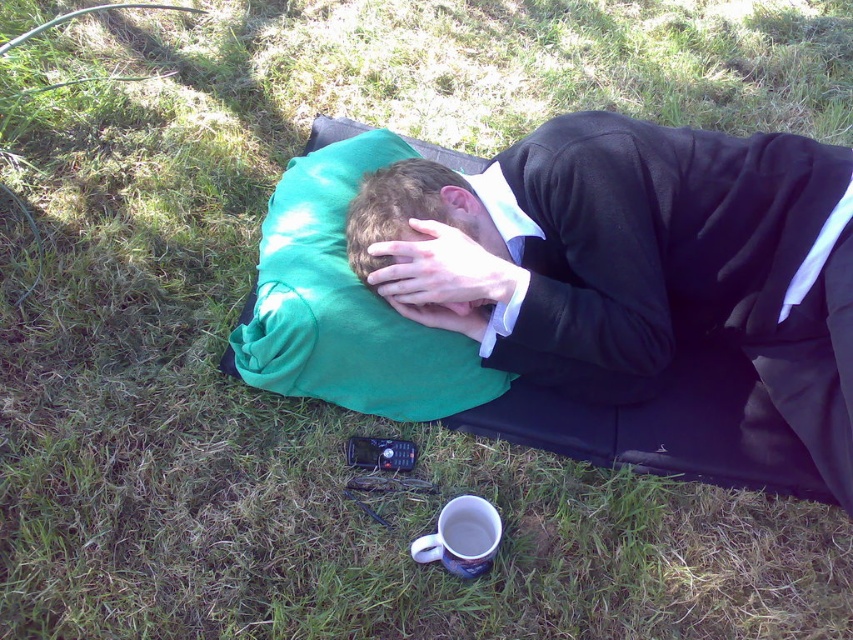
Consider the image. You are a delivery robot with a package that is 10 inches long. You need to place it between the matte black jacket at center and the matte green pillow at center. Is there enough space between them to fit the package?

The distance between the matte black jacket at center and the matte green pillow at center is 8.20 inches. Since the package is 10 inches long, it will not fit in the space between them.

Based on the photo, you are a photographer setting up a shoot in this grassy area. You have a matte black jacket at center and a green fabric pillow at center. Which object should you place first if you want the smaller item to be fully visible without being covered by the larger one?

The green fabric pillow at center is smaller than the matte black jacket at center. To ensure the smaller item remains visible, place the matte black jacket at center first, then position the green fabric pillow at center so it doesn not get covered.